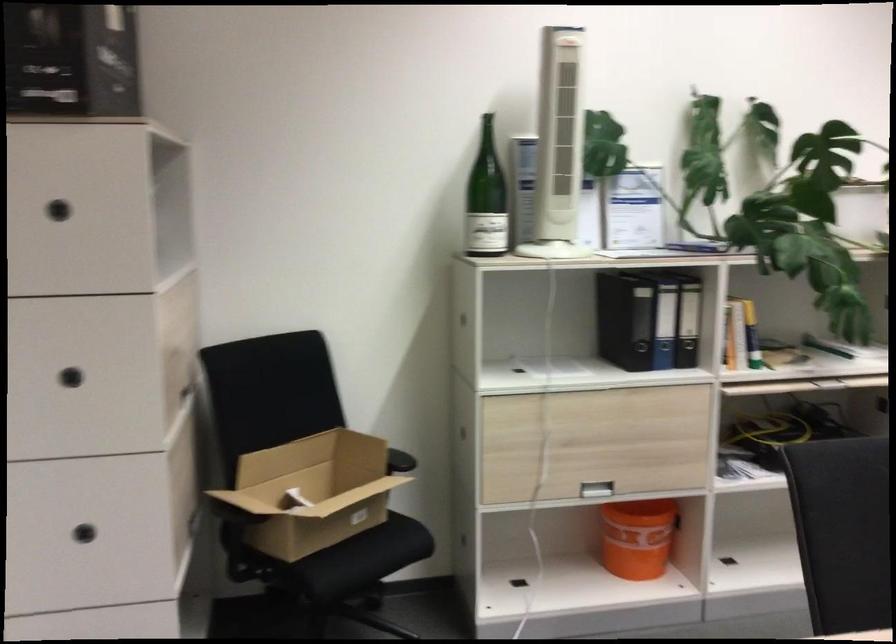
Where is `chair armrest`? chair armrest is located at coordinates (398, 459).